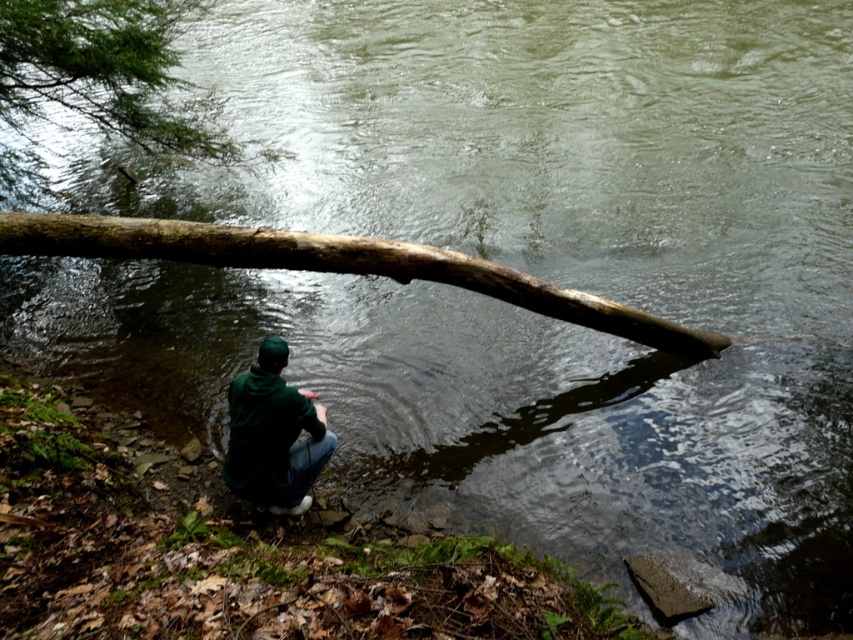
Question: Is brown rough log at center to the right of dark green hoodie at lower center from the viewer's perspective?

Choices:
 (A) yes
 (B) no

Answer: (A)

Question: Observing the image, what is the correct spatial positioning of brown rough log at center in reference to dark green hoodie at lower center?

Choices:
 (A) above
 (B) below

Answer: (A)

Question: Among these objects, which one is nearest to the camera?

Choices:
 (A) dark green hoodie at lower center
 (B) brown rough log at center

Answer: (A)

Question: Is brown rough log at center below dark green hoodie at lower center?

Choices:
 (A) yes
 (B) no

Answer: (B)

Question: Which of the following is the closest to the observer?

Choices:
 (A) dark green hoodie at lower center
 (B) brown rough log at center

Answer: (A)